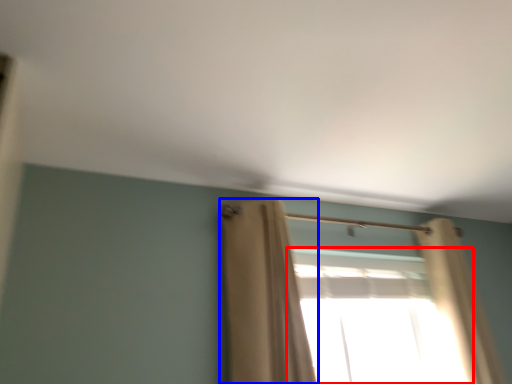
Question: Which object is closer to the camera taking this photo, window (highlighted by a red box) or curtain (highlighted by a blue box)?

Choices:
 (A) window
 (B) curtain

Answer: (B)